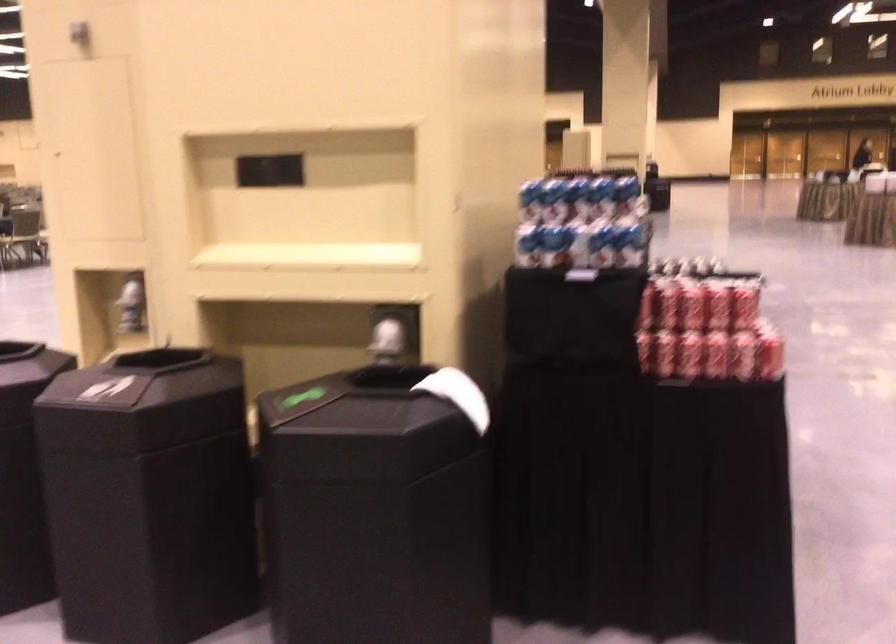
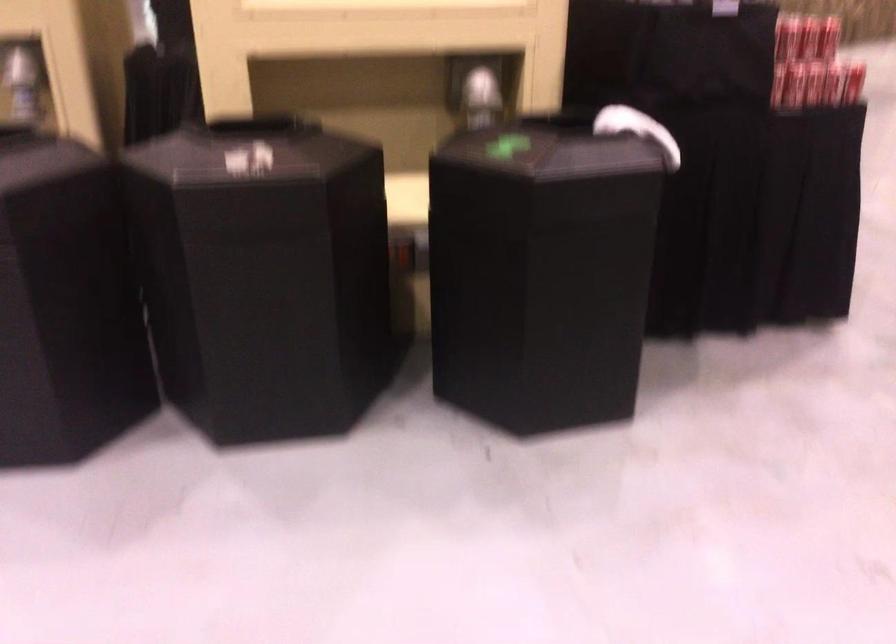
Question: The images are taken continuously from a first-person perspective. In which direction are you moving?

Choices:
 (A) Left
 (B) Right
 (C) Forward
 (D) Backward

Answer: (A)